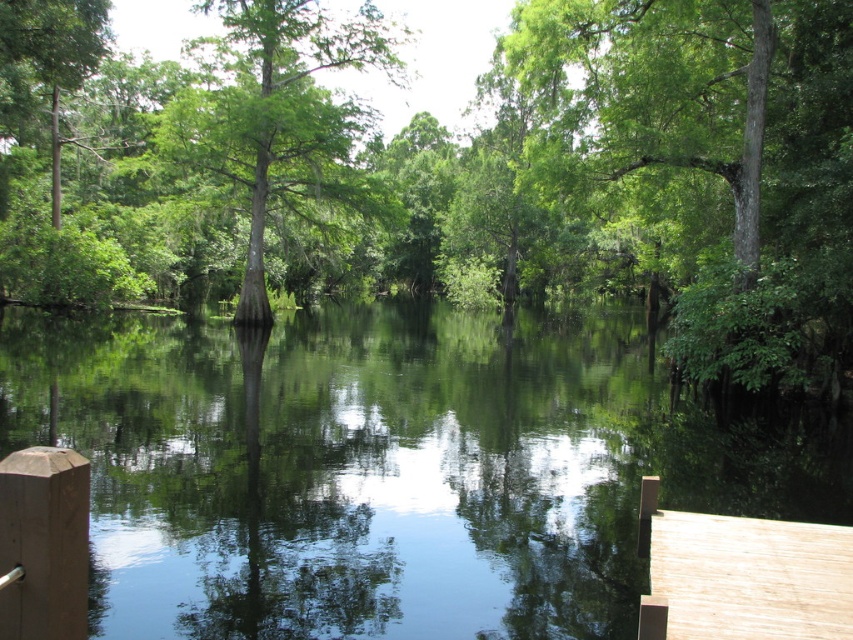
Question: Considering the real-world distances, which object is closest to the green reflective water at center?

Choices:
 (A) brown wooden deck at lower right
 (B) green matte tree at center
 (C) green leafy tree at center

Answer: (A)

Question: Is the position of green reflective water at center more distant than that of green matte tree at center?

Choices:
 (A) yes
 (B) no

Answer: (B)

Question: Which object appears farthest from the camera in this image?

Choices:
 (A) green leafy tree at center
 (B) green matte tree at center

Answer: (B)

Question: Considering the relative positions of green leafy tree at center and green matte tree at center in the image provided, where is green leafy tree at center located with respect to green matte tree at center?

Choices:
 (A) below
 (B) above

Answer: (A)

Question: Does green leafy tree at center come in front of brown wooden deck at lower right?

Choices:
 (A) yes
 (B) no

Answer: (B)

Question: Which point is closer to the camera?

Choices:
 (A) (846, 634)
 (B) (622, 134)

Answer: (A)